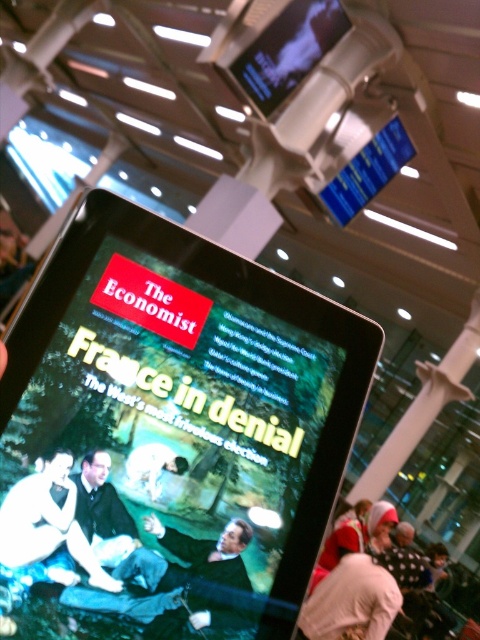
Question: Which of the following is the farthest from the observer?

Choices:
 (A) (396, 589)
 (B) (132, 604)
 (C) (34, 573)

Answer: (A)

Question: Which point is closer to the camera?

Choices:
 (A) white cotton sweater at lower right
 (B) black glossy tablet at center
 (C) smooth skin figure at center

Answer: (B)

Question: Where is green fabric couch at center located in relation to white cotton sweater at lower right in the image?

Choices:
 (A) above
 (B) below

Answer: (A)

Question: Is white cotton sweater at lower right below smooth skin figure at center?

Choices:
 (A) yes
 (B) no

Answer: (A)

Question: In this image, where is black glossy tablet at center located relative to white cotton sweater at lower right?

Choices:
 (A) below
 (B) above

Answer: (B)

Question: Which point is closer to the camera?

Choices:
 (A) (352, 627)
 (B) (180, 465)
 (C) (193, 589)
 (D) (67, 538)

Answer: (D)